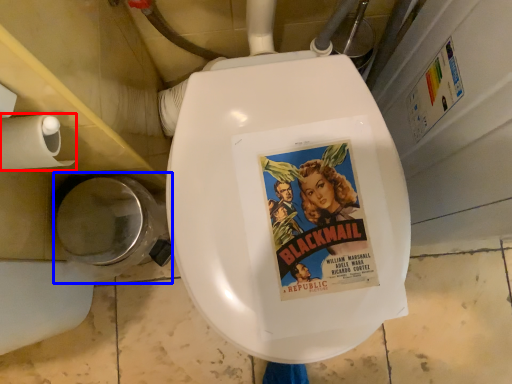
Question: Which point is closer to the camera, toilet paper (highlighted by a red box) or toilet bowl (highlighted by a blue box)?

Choices:
 (A) toilet paper
 (B) toilet bowl

Answer: (A)